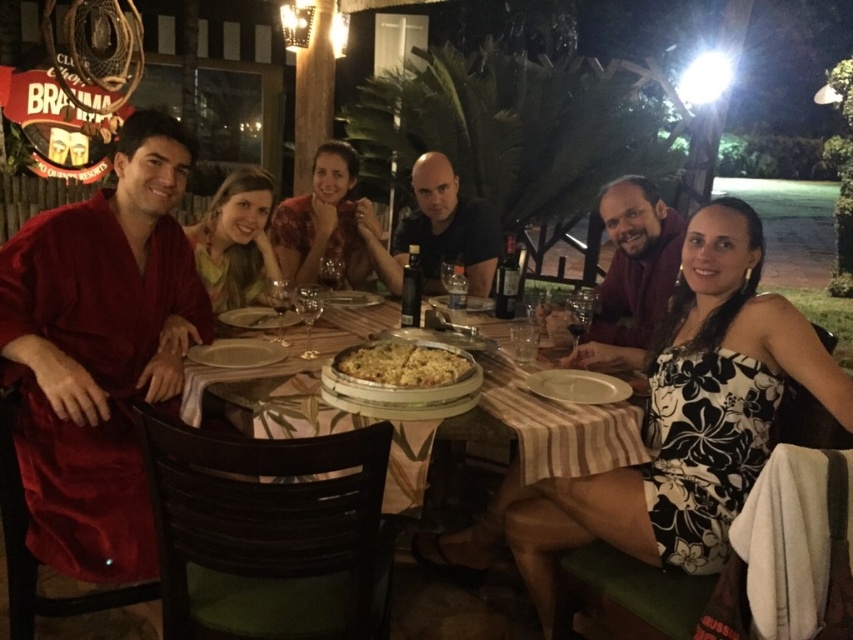
Who is shorter, wooden table at center or golden crispy pizza at center?

Standing shorter between the two is golden crispy pizza at center.

Does wooden table at center have a smaller size compared to golden crispy pizza at center?

No.

Where is `wooden table at center`? wooden table at center is located at coordinates (556, 426).

I want to click on wooden table at center, so click(556, 426).

Who is lower down, wooden table at center or matte yellow scarf at center?

Positioned lower is wooden table at center.

Can you confirm if wooden table at center is positioned above matte yellow scarf at center?

No, wooden table at center is not above matte yellow scarf at center.

Identify the location of wooden table at center. This screenshot has width=853, height=640. (556, 426).

Locate an element on the screen. wooden table at center is located at coordinates (556, 426).

Does matte red robe at left have a greater height compared to wooden table at center?

Yes.

Between point (94, 497) and point (256, 392), which one is positioned in front?

Point (94, 497)

Who is more distant from viewer, (178, 344) or (242, 332)?

The point (242, 332) is behind.

You are a GUI agent. You are given a task and a screenshot of the screen. Output one action in this format:
    pyautogui.click(x=<x>, y=<y>)
    Task: Click on the matte red robe at left
    The image size is (853, 640).
    Given the screenshot: What is the action you would take?
    pyautogui.click(x=100, y=352)